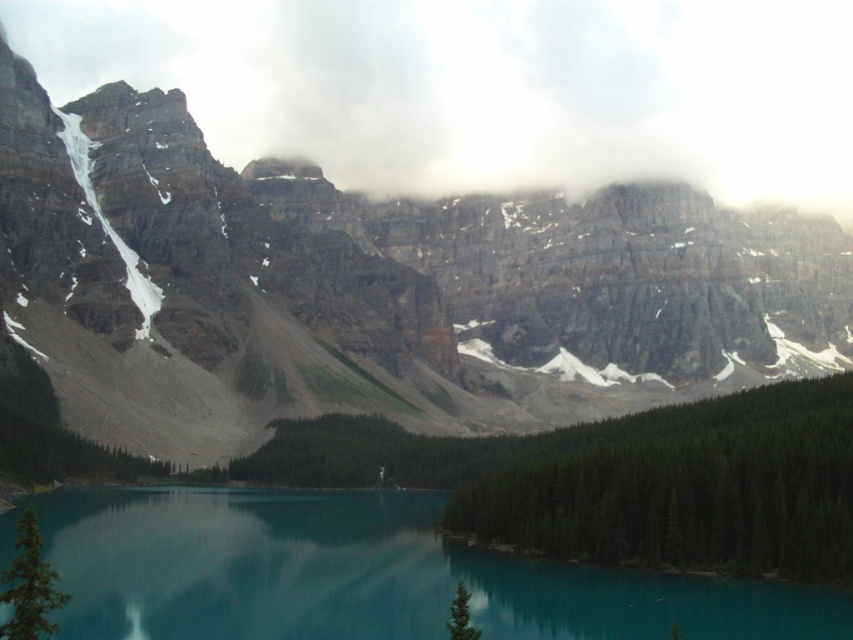
You are a photographer planning to capture the reflection of the white fluffy cloud at upper center and the teal glassy water at center in the lake. Considering their sizes, which object will have a larger reflection on the lake?

The white fluffy cloud at upper center will have a larger reflection on the lake because it is bigger than the teal glassy water at center.

You are a hiker standing at the edge of the lake and looking towards the mountains. You see the rocky cliff at center and the white fluffy cloud at upper center. Which object is closer to you?

The rocky cliff at center is closer to the viewer than the white fluffy cloud at upper center.

You are a drone operator planning to fly a drone from the rocky cliff at center to the white fluffy cloud at upper center. The drone has a maximum flight range of 85 meters. Based on the scene, will the drone be able to reach the cloud?

The rocky cliff at center is 85.46 meters from the white fluffy cloud at upper center. Since the drone can only fly up to 85 meters, it cannot reach the cloud as the distance is slightly beyond its range.